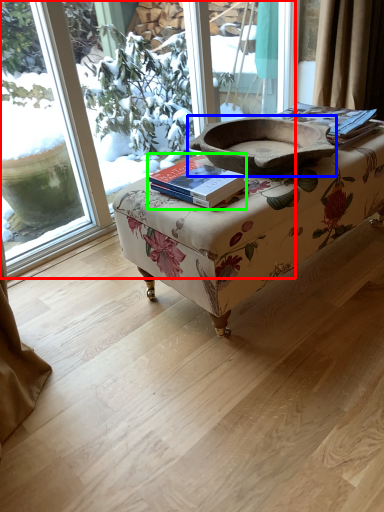
Question: Which object is positioned closest to window (highlighted by a red box)? Select from footrest (highlighted by a blue box) and paperback book (highlighted by a green box).

Choices:
 (A) footrest
 (B) paperback book

Answer: (A)